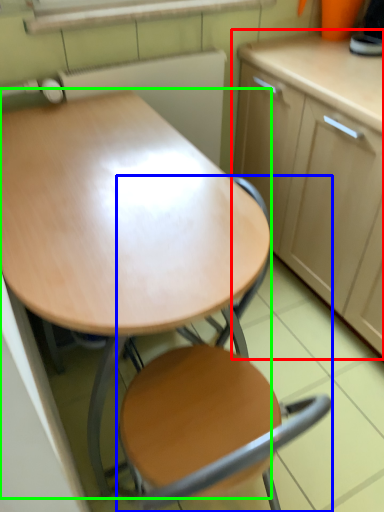
Question: Based on their relative distances, which object is farther from cabinetry (highlighted by a red box)? Choose from chair (highlighted by a blue box) and desk (highlighted by a green box).

Choices:
 (A) chair
 (B) desk

Answer: (A)